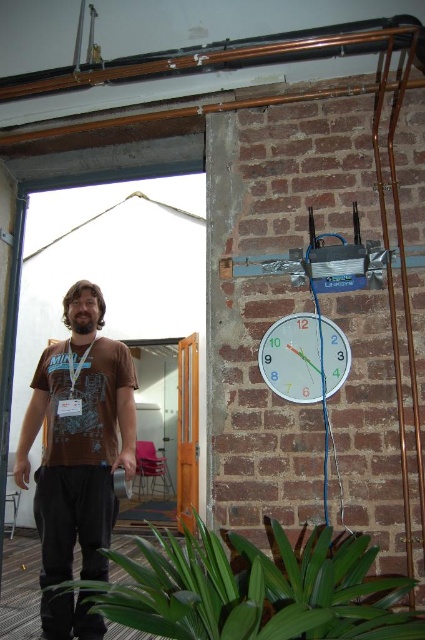
Question: Does brown cotton t-shirt at left appear under white plastic clock at upper right?

Choices:
 (A) no
 (B) yes

Answer: (B)

Question: Which object is positioned farthest from the green leafy plant at lower center?

Choices:
 (A) white plastic clock at upper right
 (B) brown cotton t-shirt at left

Answer: (B)

Question: Which object is farther from the camera taking this photo?

Choices:
 (A) brown cotton t-shirt at left
 (B) white plastic clock at upper right
 (C) green leafy plant at lower center

Answer: (A)

Question: Is brown cotton t-shirt at left smaller than white plastic clock at upper right?

Choices:
 (A) yes
 (B) no

Answer: (B)

Question: In this image, where is green leafy plant at lower center located relative to white plastic clock at upper right?

Choices:
 (A) right
 (B) left

Answer: (B)

Question: Considering the real-world distances, which object is closest to the white plastic clock at upper right?

Choices:
 (A) green leafy plant at lower center
 (B) brown cotton t-shirt at left

Answer: (A)